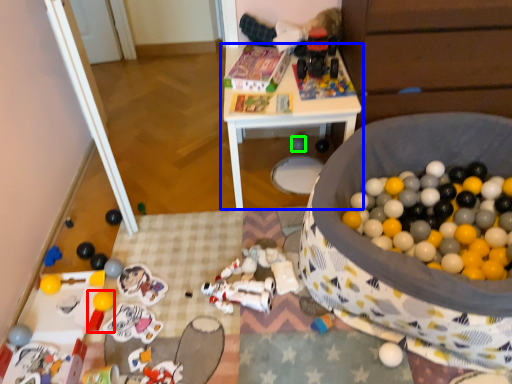
Question: Which object is positioned closest to toy (highlighted by a red box)? Select from table (highlighted by a blue box) and toy (highlighted by a green box).

Choices:
 (A) table
 (B) toy

Answer: (A)